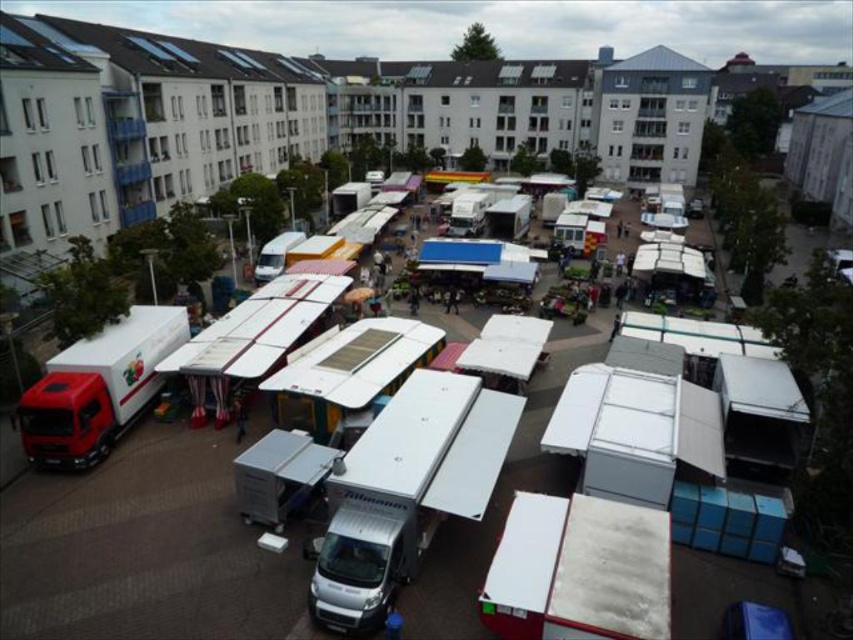
Question: Which point is closer to the camera taking this photo?

Choices:
 (A) (282, 252)
 (B) (38, 394)

Answer: (B)

Question: Which point appears farthest from the camera in this image?

Choices:
 (A) (103, 346)
 (B) (264, 275)

Answer: (B)

Question: Is red matte truck at left positioned in front of white matte van at center?

Choices:
 (A) yes
 (B) no

Answer: (A)

Question: Considering the relative positions of red matte truck at left and white matte van at center in the image provided, where is red matte truck at left located with respect to white matte van at center?

Choices:
 (A) below
 (B) above

Answer: (A)

Question: Can you confirm if red matte truck at left is smaller than white matte van at center?

Choices:
 (A) yes
 (B) no

Answer: (B)